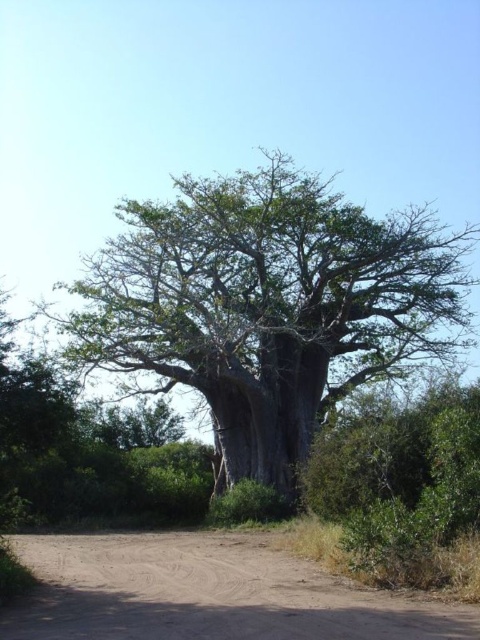
You are standing at the origin point of the coordinate system. Can you see the green rough bark tree at center from your current position?

The green rough bark tree at center is located at point (268, 305), which is within the field of view from the origin point, so yes, you can see the green rough bark tree at center from your current position.

From the picture: You are standing in front of the baobab tree and want to take a photo. There are two points of interest marked on the tree trunk at coordinates point (274, 403) and point (60, 561). Which point is closer to your camera lens when taking the photo?

Point (60, 561) is closer to the camera lens because the description states that point (274, 403) is further to the camera than point (60, 561).

You are a hiker who wants to take a photo of the green rough bark tree at center from the brown sandy dirt track at lower center. Since the tree is taller than the track, will you need to tilt your camera upwards to capture the entire tree in the photo?

The green rough bark tree at center is taller than the brown sandy dirt track at lower center. To capture the entire tree in the photo, you would need to tilt your camera upwards because the tree is taller than the track.